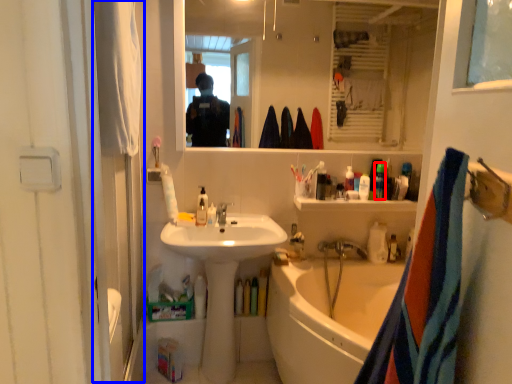
Question: Among these objects, which one is farthest to the camera, toiletry (highlighted by a red box) or screen door (highlighted by a blue box)?

Choices:
 (A) toiletry
 (B) screen door

Answer: (A)